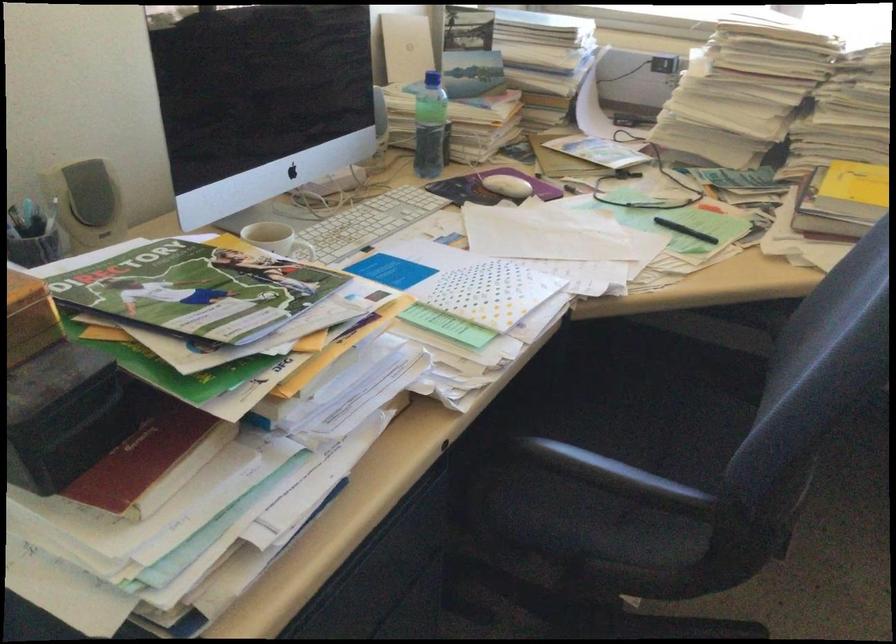
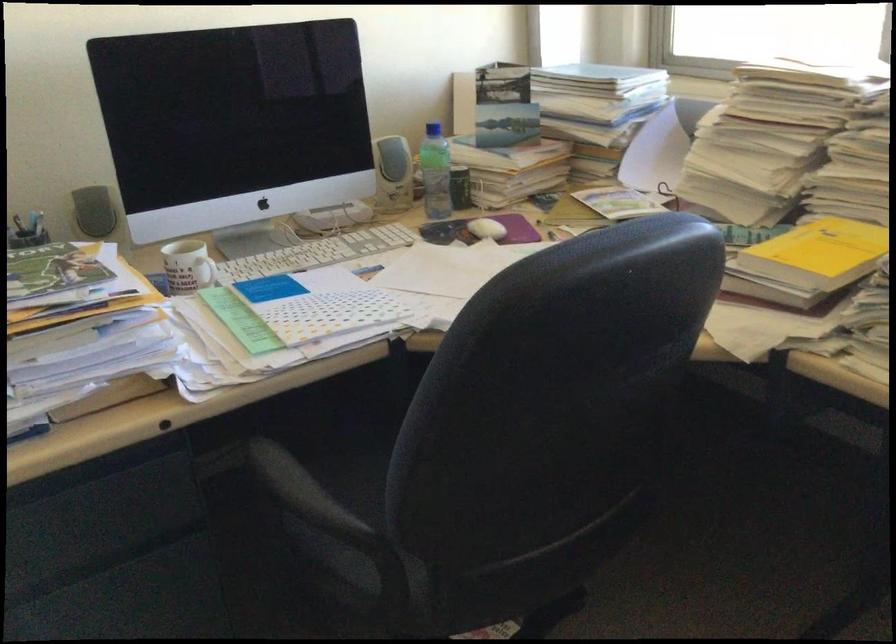
Question: I am providing you with two images of the same scene from different viewpoints. After the viewpoint changes to image2, which objects are now occluded?

Choices:
 (A) white mug handle
 (B) black chair armrest
 (C) black pen
 (D) small plush toy

Answer: (C)